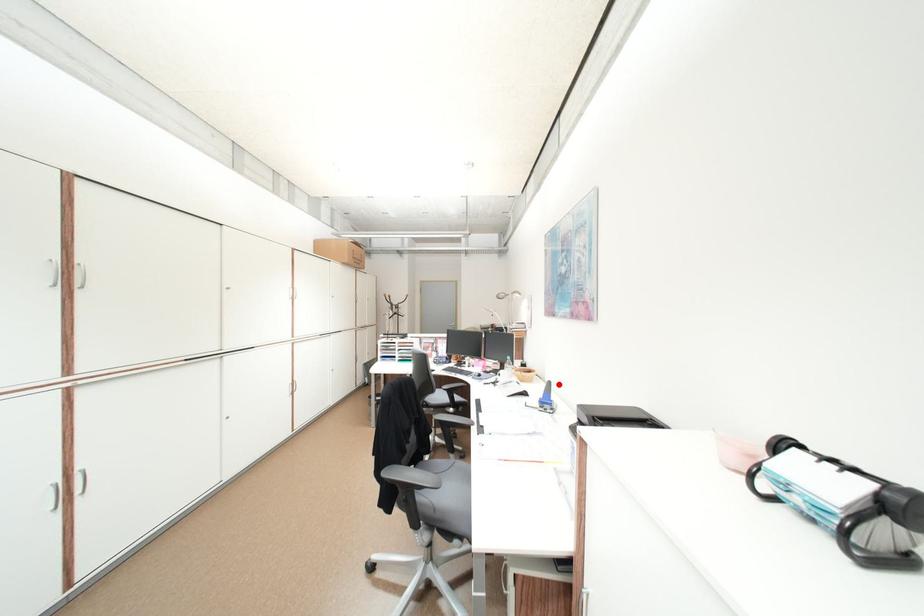
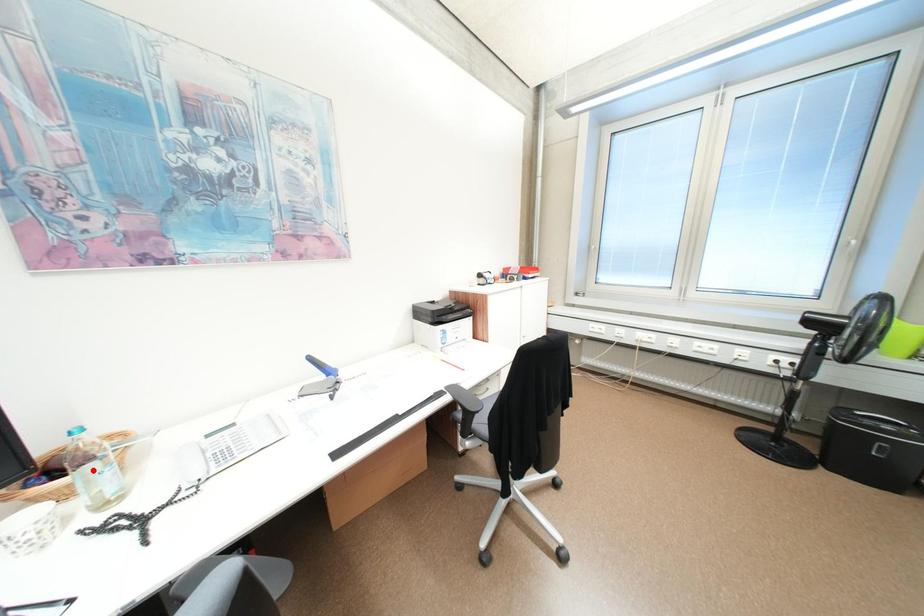
I am providing you with two images of the same scene from different viewpoints. A red point is marked on the first image and another point is marked on the second image. Are the points marked in image1 and image2 representing the same 3D position?

No